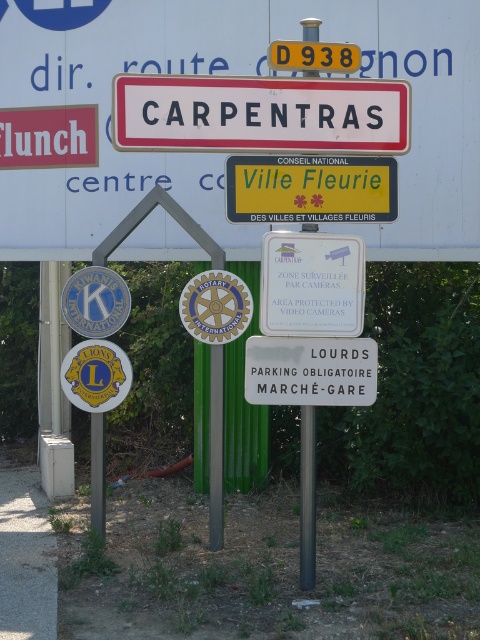
What is the position of the white plastic signboard at center relative to the yellow plastic road sign at upper center?

The white plastic signboard at center is to the left of the yellow plastic road sign at upper center.

You are standing in front of the signpost near Carpentras, France. There are two points marked on the signpost at coordinates point(404, 129) and point(354, 264). Which point is closer to you?

Point(354, 264) is closer to you because it is closer to the camera than point(404, 129).